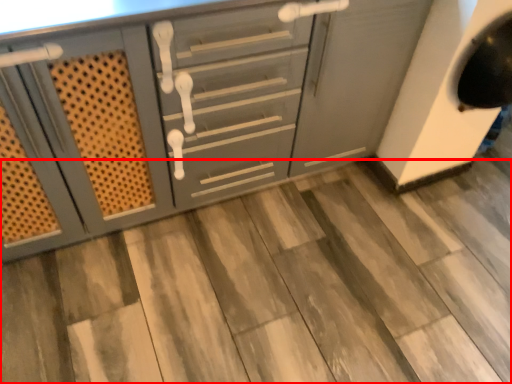
Question: From the image, what is the correct spatial relationship of tile (annotated by the red box) in relation to cabinetry?

Choices:
 (A) right
 (B) left

Answer: (A)